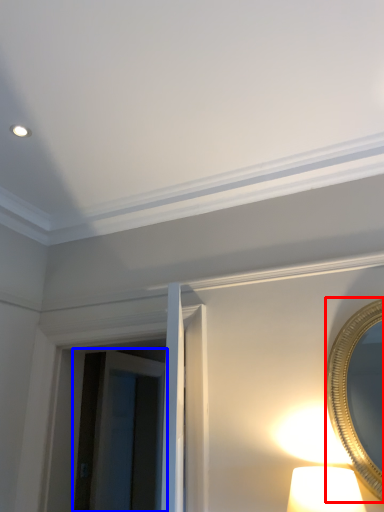
Question: Which point is closer to the camera, mirror (highlighted by a red box) or glass door (highlighted by a blue box)?

Choices:
 (A) mirror
 (B) glass door

Answer: (A)